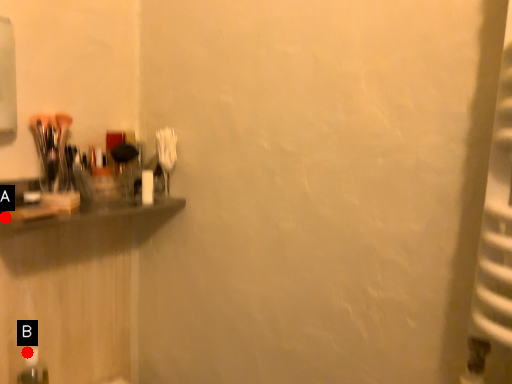
Question: Two points are circled on the image, labeled by A and B beside each circle. Which point is closer to the camera taking this photo?

Choices:
 (A) A is closer
 (B) B is closer

Answer: (A)